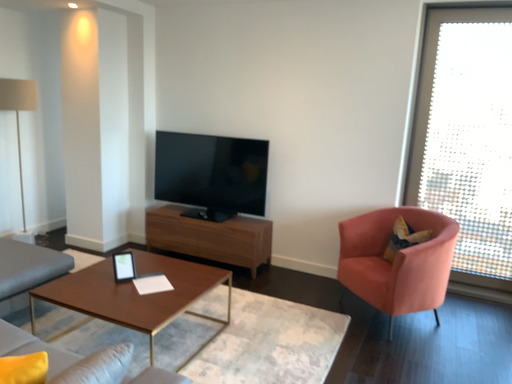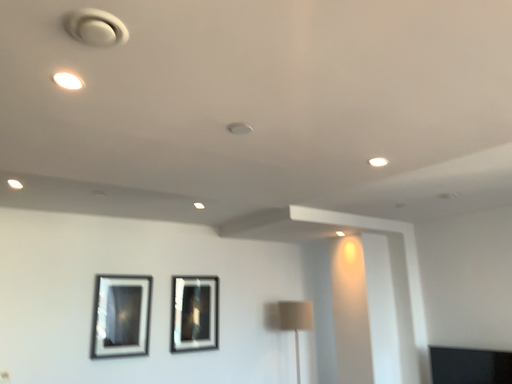
Question: How did the camera likely rotate when shooting the video?

Choices:
 (A) rotated upward
 (B) rotated downward

Answer: (A)